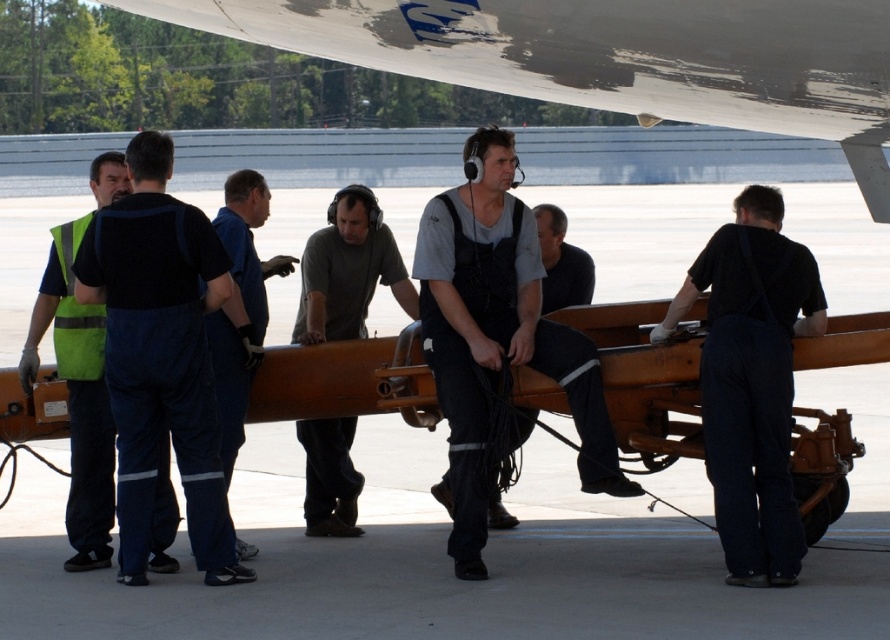
Question: Considering the relative positions of dark gray fabric vest at center and black fabric overall at right in the image provided, where is dark gray fabric vest at center located with respect to black fabric overall at right?

Choices:
 (A) above
 (B) below

Answer: (A)

Question: Which object is positioned closest to the blue uniform at center?

Choices:
 (A) black fabric overall at right
 (B) dark gray fabric vest at center
 (C) reflective green vest at left

Answer: (C)

Question: Which point is farther from the camera taking this photo?

Choices:
 (A) (66, 257)
 (B) (708, 316)

Answer: (A)

Question: Is blue uniform at center smaller than dark gray fabric shirt at center?

Choices:
 (A) no
 (B) yes

Answer: (A)

Question: Does dark blue overalls at left appear on the right side of gray fabric shirt at center?

Choices:
 (A) no
 (B) yes

Answer: (A)

Question: Which point is closer to the camera taking this photo?

Choices:
 (A) (85, 451)
 (B) (551, 250)

Answer: (A)